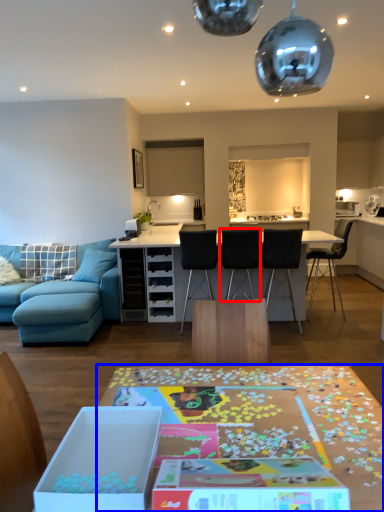
Question: Which point is further to the camera, chair (highlighted by a red box) or table (highlighted by a blue box)?

Choices:
 (A) chair
 (B) table

Answer: (A)